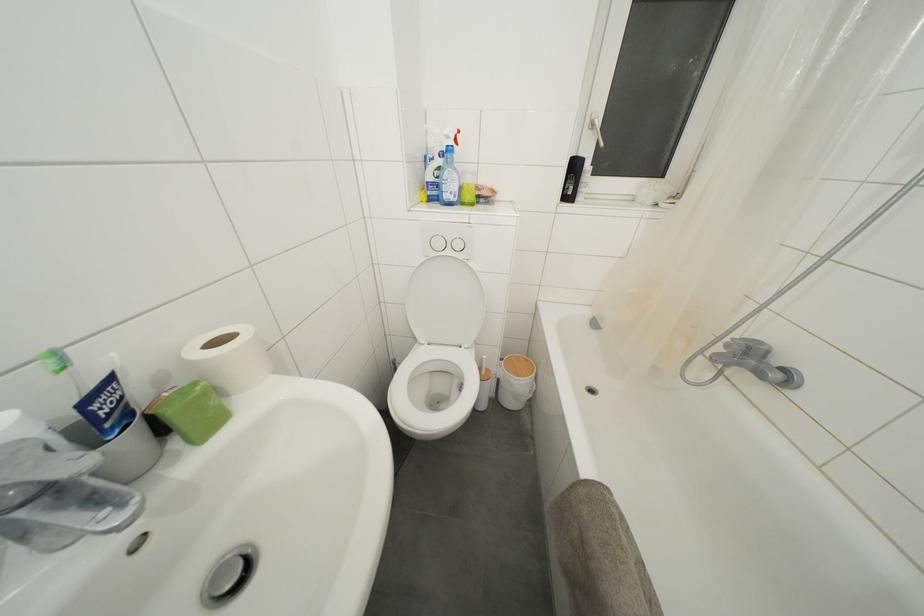
Where is `sink faucet handle`? This screenshot has height=616, width=924. sink faucet handle is located at coordinates (748, 339).